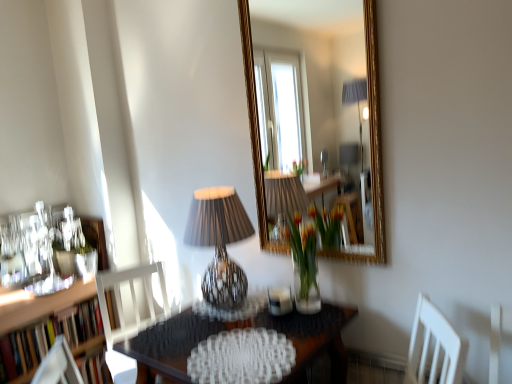
The height and width of the screenshot is (384, 512). What are the coordinates of `vacant position to the left of translucent glass vase at center` in the screenshot? It's located at (261, 303).